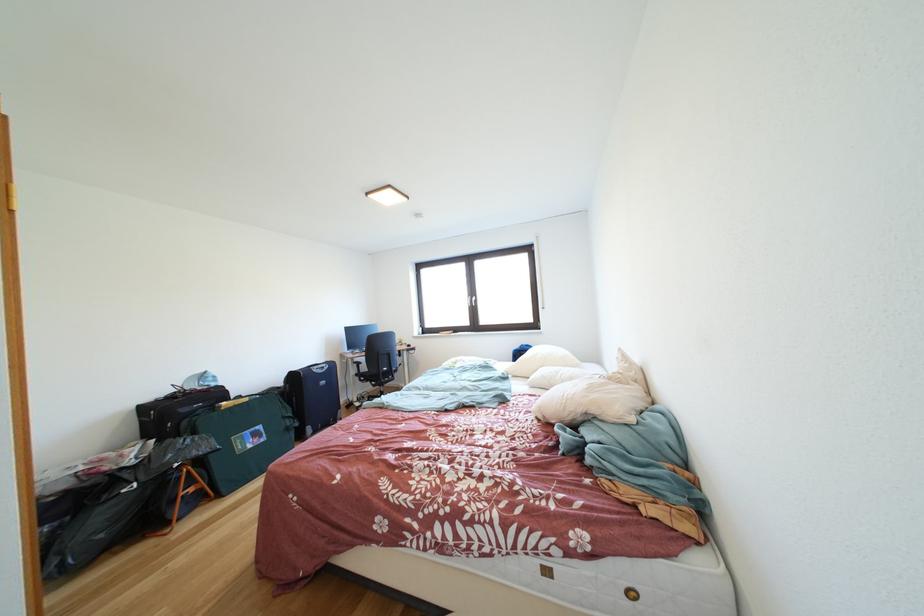
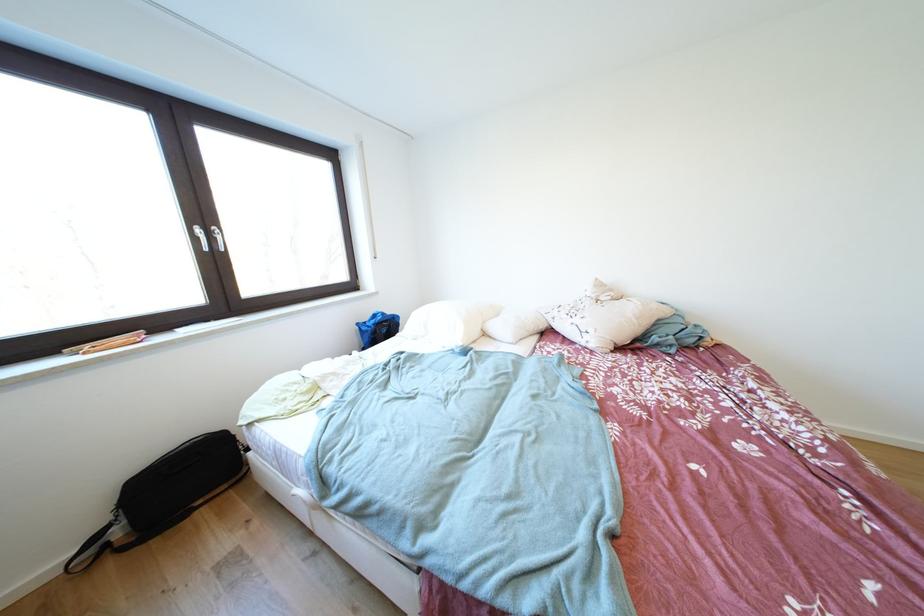
Where in the second image is the point corresponding to point 627,354 from the first image?

(604, 284)